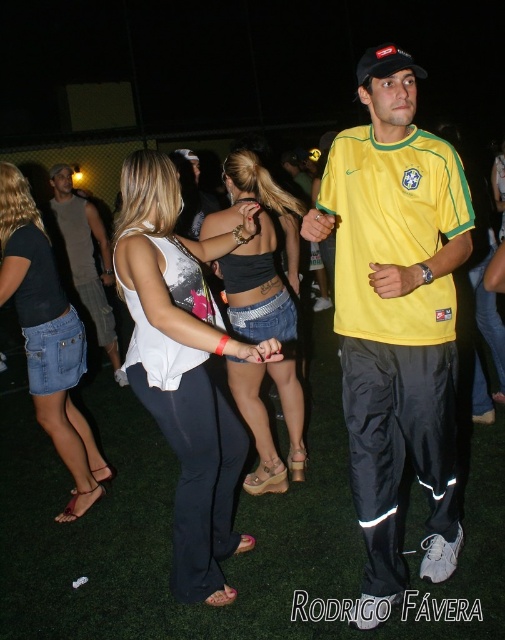
You are a photographer standing at the center of the image. You want to take a photo of the yellow fabric shirt at center and the two women holding hands on the left. Can you fit both subjects in the frame if your camera has a 1.8 meter wide lens?

The two women holding hands on the left and the yellow fabric shirt at center are 1.98 meters apart. Since the camera lens can only capture 1.8 meters, they cannot both fit in the frame.

You are standing at the camera position and want to throw a frisbee to either the point at coordinates point (449, 204) or point (50, 387). Which point is closer to you?

Point (449, 204) is closer to the camera than point (50, 387), so you should aim for that point.

You are a photographer at the event and want to ensure both the yellow fabric shirt at center and the white fabric top at center are clearly visible in your photo. Given their sizes, which one might you need to adjust your camera focus on to capture more detail?

The yellow fabric shirt at center is smaller than the white fabric top at center, so you might need to adjust your camera focus on the yellow fabric shirt at center to ensure its details are captured clearly despite its smaller size.